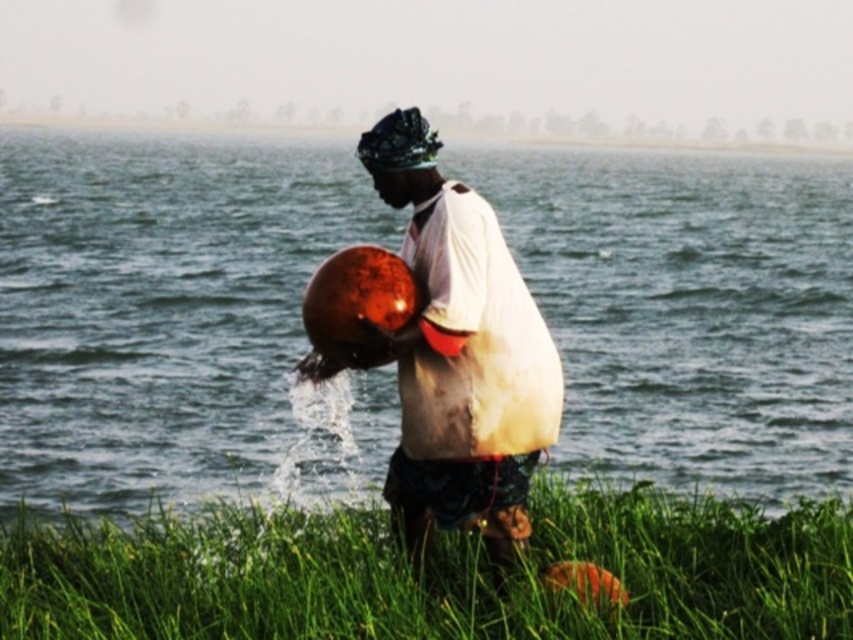
Question: Is glossy metallic water at center bigger than green grass at lower center?

Choices:
 (A) no
 (B) yes

Answer: (B)

Question: Does glossy metallic water at center have a larger size compared to green grass at lower center?

Choices:
 (A) no
 (B) yes

Answer: (B)

Question: Can you confirm if glossy metallic water at center is positioned below shiny metallic pot at center?

Choices:
 (A) yes
 (B) no

Answer: (B)

Question: Among these objects, which one is farthest from the camera?

Choices:
 (A) shiny metallic pot at center
 (B) glossy metallic water at center
 (C) green grass at lower center

Answer: (B)

Question: Estimate the real-world distances between objects in this image. Which object is farther from the glossy metallic water at center?

Choices:
 (A) shiny metallic pot at center
 (B) green grass at lower center

Answer: (B)

Question: Which object is the farthest from the shiny metallic pot at center?

Choices:
 (A) glossy metallic water at center
 (B) green grass at lower center

Answer: (A)